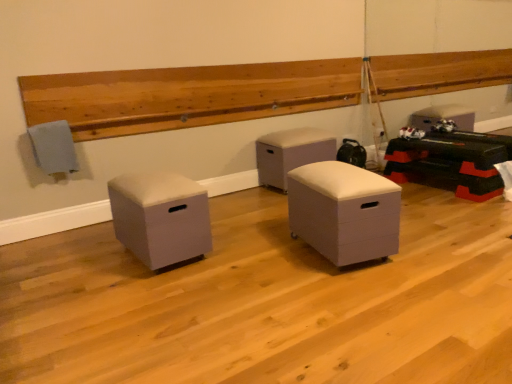
Locate an element on the screen. The height and width of the screenshot is (384, 512). white matte storage ottoman at center, the first furniture viewed from the front is located at coordinates (344, 211).

Which is correct: white matte storage ottoman at center, the first furniture viewed from the front, is inside white leather ottoman at center, the 2th furniture in the right-to-left sequence, or outside of it?

white matte storage ottoman at center, the first furniture viewed from the front, lies outside white leather ottoman at center, the 2th furniture in the right-to-left sequence.

Find the location of a particular element. The width and height of the screenshot is (512, 384). the 2nd furniture behind the white matte storage ottoman at center, the first furniture viewed from the front is located at coordinates (291, 153).

Considering the relative sizes of white matte storage ottoman at center, which ranks as the 1th furniture in right-to-left order, and white leather ottoman at center, which appears as the 3th furniture when viewed from the front, in the image provided, is white matte storage ottoman at center, which ranks as the 1th furniture in right-to-left order, smaller than white leather ottoman at center, which appears as the 3th furniture when viewed from the front,?

Yes, white matte storage ottoman at center, which ranks as the 1th furniture in right-to-left order, is smaller than white leather ottoman at center, which appears as the 3th furniture when viewed from the front.

Can you confirm if white matte storage ottoman at center, which is counted as the third furniture, starting from the back, is thinner than white leather ottoman at center, the 1th furniture in the back-to-front sequence?

Correct, the width of white matte storage ottoman at center, which is counted as the third furniture, starting from the back, is less than that of white leather ottoman at center, the 1th furniture in the back-to-front sequence.

From a real-world perspective, which object stands above the other?

From a 3D spatial view, white leather ottoman at center, acting as the 2th furniture starting from the left, is above.

Based on the photo, can you confirm if matte gray ottoman at left, which is the 2th furniture in front-to-back order, is thinner than white leather ottoman at center, which appears as the 3th furniture when viewed from the front?

No.

Does point (174, 242) appear closer or farther from the camera than point (261, 174)?

Point (174, 242).

Can you tell me how much matte gray ottoman at left, which is the 2th furniture in front-to-back order, and white leather ottoman at center, acting as the 2th furniture starting from the left, differ in facing direction?

The angular difference between matte gray ottoman at left, which is the 2th furniture in front-to-back order, and white leather ottoman at center, acting as the 2th furniture starting from the left, is 1.04 degrees.

Considering the positions of objects matte gray ottoman at left, the second furniture positioned from the back, and white matte storage ottoman at center, which ranks as the 1th furniture in right-to-left order, in the image provided, who is more to the left, matte gray ottoman at left, the second furniture positioned from the back, or white matte storage ottoman at center, which ranks as the 1th furniture in right-to-left order,?

Positioned to the left is matte gray ottoman at left, the second furniture positioned from the back.

Is matte gray ottoman at left, the third furniture when ordered from right to left, further to the viewer compared to white matte storage ottoman at center, which is counted as the third furniture, starting from the back?

Yes, the depth of matte gray ottoman at left, the third furniture when ordered from right to left, is greater than that of white matte storage ottoman at center, which is counted as the third furniture, starting from the back.

You are a GUI agent. You are given a task and a screenshot of the screen. Output one action in this format:
    pyautogui.click(x=<x>, y=<y>)
    Task: Click on the 2nd furniture counting from the left of the white matte storage ottoman at center, which ranks as the 1th furniture in right-to-left order
    The width and height of the screenshot is (512, 384).
    Given the screenshot: What is the action you would take?
    pyautogui.click(x=160, y=217)

Would you consider matte gray ottoman at left, the third furniture when ordered from right to left, to be distant from white matte storage ottoman at center, the first furniture viewed from the front?

matte gray ottoman at left, the third furniture when ordered from right to left, is near white matte storage ottoman at center, the first furniture viewed from the front, not far away.

From the image's perspective, is white matte storage ottoman at center, which is counted as the third furniture, starting from the back, located beneath matte gray ottoman at left, which is the 2th furniture in front-to-back order?

No.

In terms of height, does white matte storage ottoman at center, the first furniture viewed from the front, look taller or shorter compared to matte gray ottoman at left, the third furniture when ordered from right to left?

In the image, white matte storage ottoman at center, the first furniture viewed from the front, appears to be taller than matte gray ottoman at left, the third furniture when ordered from right to left.

Is white matte storage ottoman at center, which is counted as the third furniture, starting from the left, smaller than matte gray ottoman at left, which is the 2th furniture in front-to-back order?

No, white matte storage ottoman at center, which is counted as the third furniture, starting from the left, is not smaller than matte gray ottoman at left, which is the 2th furniture in front-to-back order.

From the image's perspective, is white leather ottoman at center, the 1th furniture in the back-to-front sequence, located beneath white matte storage ottoman at center, the first furniture viewed from the front?

No, from the image's perspective, white leather ottoman at center, the 1th furniture in the back-to-front sequence, is not below white matte storage ottoman at center, the first furniture viewed from the front.

At what (x,y) coordinates should I click in order to perform the action: click on furniture that is the 1st one when counting downward from the white leather ottoman at center, which appears as the 3th furniture when viewed from the front (from the image's perspective). Please return your answer as a coordinate pair (x, y). Looking at the image, I should click on tap(344, 211).

How much distance is there between white leather ottoman at center, the 2th furniture in the right-to-left sequence, and white matte storage ottoman at center, which ranks as the 1th furniture in right-to-left order?

4.42 feet.

Does white leather ottoman at center, which appears as the 3th furniture when viewed from the front, contain white matte storage ottoman at center, the first furniture viewed from the front?

No, white matte storage ottoman at center, the first furniture viewed from the front, is not inside white leather ottoman at center, which appears as the 3th furniture when viewed from the front.

Is white leather ottoman at center, the 2th furniture in the right-to-left sequence, bigger than matte gray ottoman at left, which is the 1th furniture from left to right?

Indeed, white leather ottoman at center, the 2th furniture in the right-to-left sequence, has a larger size compared to matte gray ottoman at left, which is the 1th furniture from left to right.

Does white leather ottoman at center, acting as the 2th furniture starting from the left, have a greater height compared to matte gray ottoman at left, the third furniture when ordered from right to left?

Correct, white leather ottoman at center, acting as the 2th furniture starting from the left, is much taller as matte gray ottoman at left, the third furniture when ordered from right to left.

Is white leather ottoman at center, acting as the 2th furniture starting from the left, not inside matte gray ottoman at left, the second furniture positioned from the back?

white leather ottoman at center, acting as the 2th furniture starting from the left, lies outside matte gray ottoman at left, the second furniture positioned from the back,'s area.

This screenshot has width=512, height=384. Identify the location of furniture lying on the right of white leather ottoman at center, the 1th furniture in the back-to-front sequence. (344, 211).

Find the location of `furniture behind the matte gray ottoman at left, which is the 2th furniture in front-to-back order`. furniture behind the matte gray ottoman at left, which is the 2th furniture in front-to-back order is located at coordinates (291, 153).

Consider the image. Which object lies further to the anchor point white matte storage ottoman at center, which is counted as the third furniture, starting from the left, matte gray ottoman at left, the second furniture positioned from the back, or white leather ottoman at center, the 1th furniture in the back-to-front sequence?

white leather ottoman at center, the 1th furniture in the back-to-front sequence.

From the image, which object appears to be farther from white leather ottoman at center, acting as the 2th furniture starting from the left, matte gray ottoman at left, which is the 1th furniture from left to right, or white matte storage ottoman at center, which ranks as the 1th furniture in right-to-left order?

matte gray ottoman at left, which is the 1th furniture from left to right, lies further to white leather ottoman at center, acting as the 2th furniture starting from the left, than the other object.

Estimate the real-world distances between objects in this image. Which object is further from matte gray ottoman at left, which is the 1th furniture from left to right, white matte storage ottoman at center, which is counted as the third furniture, starting from the left, or white leather ottoman at center, which appears as the 3th furniture when viewed from the front?

Among the two, white leather ottoman at center, which appears as the 3th furniture when viewed from the front, is located further to matte gray ottoman at left, which is the 1th furniture from left to right.

From the image, which object appears to be nearer to white matte storage ottoman at center, which is counted as the third furniture, starting from the back, white leather ottoman at center, acting as the 2th furniture starting from the left, or matte gray ottoman at left, the second furniture positioned from the back?

matte gray ottoman at left, the second furniture positioned from the back, lies closer to white matte storage ottoman at center, which is counted as the third furniture, starting from the back, than the other object.

Based on their spatial positions, is white leather ottoman at center, the 1th furniture in the back-to-front sequence, or white matte storage ottoman at center, the first furniture viewed from the front, closer to matte gray ottoman at left, the second furniture positioned from the back?

white matte storage ottoman at center, the first furniture viewed from the front, is positioned closer to the anchor matte gray ottoman at left, the second furniture positioned from the back.

From the image, which object appears to be farther from white leather ottoman at center, acting as the 2th furniture starting from the left, white matte storage ottoman at center, the first furniture viewed from the front, or matte gray ottoman at left, the second furniture positioned from the back?

matte gray ottoman at left, the second furniture positioned from the back.

The width and height of the screenshot is (512, 384). Find the location of `furniture positioned between white matte storage ottoman at center, the first furniture viewed from the front, and white leather ottoman at center, the 1th furniture in the back-to-front sequence, from near to far`. furniture positioned between white matte storage ottoman at center, the first furniture viewed from the front, and white leather ottoman at center, the 1th furniture in the back-to-front sequence, from near to far is located at coordinates (160, 217).